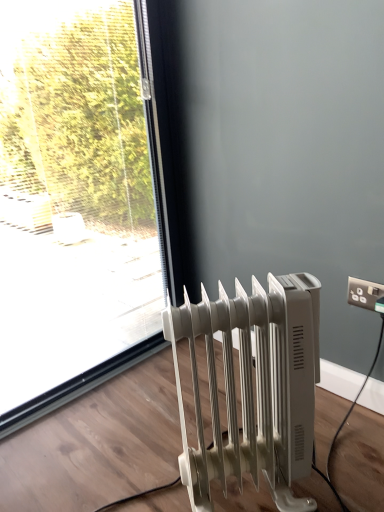
Question: From the image's perspective, is white plastic electrical outlet at upper right located above transparent glass window at upper left?

Choices:
 (A) no
 (B) yes

Answer: (A)

Question: Is white plastic electrical outlet at upper right at the right side of transparent glass window at upper left?

Choices:
 (A) yes
 (B) no

Answer: (A)

Question: Is white plastic electrical outlet at upper right oriented away from transparent glass window at upper left?

Choices:
 (A) no
 (B) yes

Answer: (A)

Question: From the image's perspective, would you say white plastic electrical outlet at upper right is shown under transparent glass window at upper left?

Choices:
 (A) no
 (B) yes

Answer: (B)

Question: Does white plastic electrical outlet at upper right come behind transparent glass window at upper left?

Choices:
 (A) yes
 (B) no

Answer: (A)

Question: Is white plastic electrical outlet at upper right thinner than transparent glass window at upper left?

Choices:
 (A) no
 (B) yes

Answer: (B)

Question: Is white plastic radiator at lower right to the left of white plastic electrical outlet at upper right from the viewer's perspective?

Choices:
 (A) no
 (B) yes

Answer: (B)

Question: Would you consider white plastic radiator at lower right to be distant from white plastic electrical outlet at upper right?

Choices:
 (A) yes
 (B) no

Answer: (B)

Question: Does white plastic radiator at lower right have a lesser width compared to white plastic electrical outlet at upper right?

Choices:
 (A) yes
 (B) no

Answer: (B)

Question: From the image's perspective, is white plastic radiator at lower right below white plastic electrical outlet at upper right?

Choices:
 (A) yes
 (B) no

Answer: (A)

Question: From a real-world perspective, is white plastic radiator at lower right on white plastic electrical outlet at upper right?

Choices:
 (A) yes
 (B) no

Answer: (B)

Question: Does white plastic radiator at lower right have a greater width compared to white plastic electrical outlet at upper right?

Choices:
 (A) no
 (B) yes

Answer: (B)

Question: Is white plastic radiator at lower right positioned far away from transparent glass window at upper left?

Choices:
 (A) no
 (B) yes

Answer: (B)